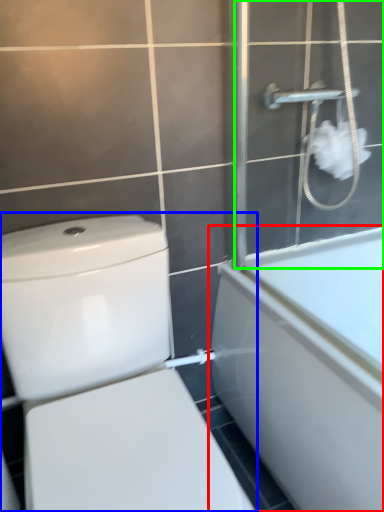
Question: Which object is the farthest from bathtub (highlighted by a red box)? Choose among these: toilet (highlighted by a blue box) or screen door (highlighted by a green box).

Choices:
 (A) toilet
 (B) screen door

Answer: (A)